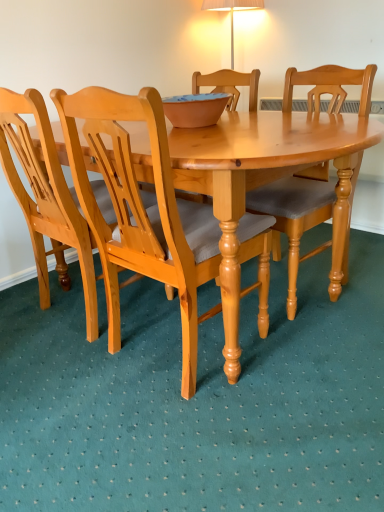
Find the location of `free region under light brown wood chair at center, which is counted as the first chair, starting from the right (from a real-world perspective)`. free region under light brown wood chair at center, which is counted as the first chair, starting from the right (from a real-world perspective) is located at coordinates (298, 284).